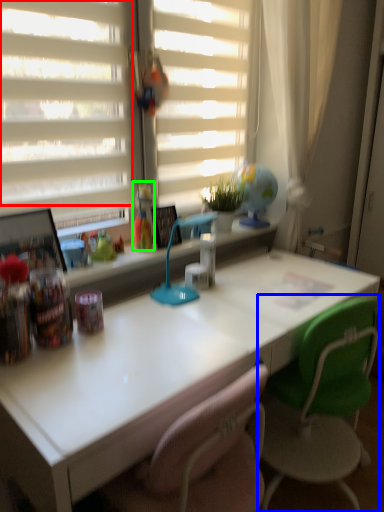
Question: Which is farther away from shutter (highlighted by a red box)? chair (highlighted by a blue box) or toy (highlighted by a green box)?

Choices:
 (A) chair
 (B) toy

Answer: (A)